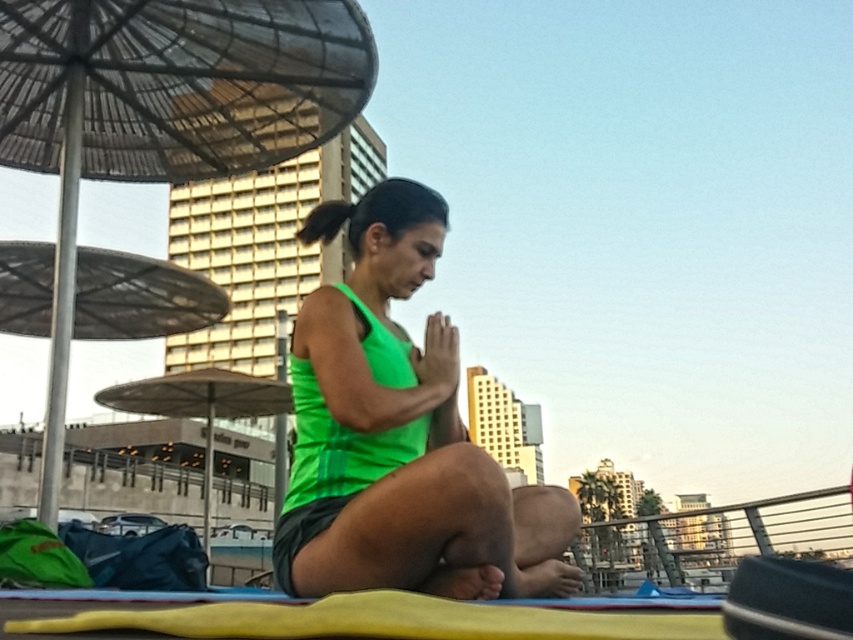
Question: Is green matte tank top at center further to camera compared to metallic umbrella at upper left?

Choices:
 (A) no
 (B) yes

Answer: (A)

Question: Is green matte tank top at center above metallic umbrella at upper left?

Choices:
 (A) yes
 (B) no

Answer: (B)

Question: Considering the relative positions of green matte tank top at center and metallic umbrella at upper left in the image provided, where is green matte tank top at center located with respect to metallic umbrella at upper left?

Choices:
 (A) left
 (B) right

Answer: (B)

Question: Which object is farther from the camera taking this photo?

Choices:
 (A) green matte tank top at center
 (B) metallic umbrella at upper left

Answer: (B)

Question: Which point is closer to the camera?

Choices:
 (A) (51, 108)
 (B) (556, 550)

Answer: (B)